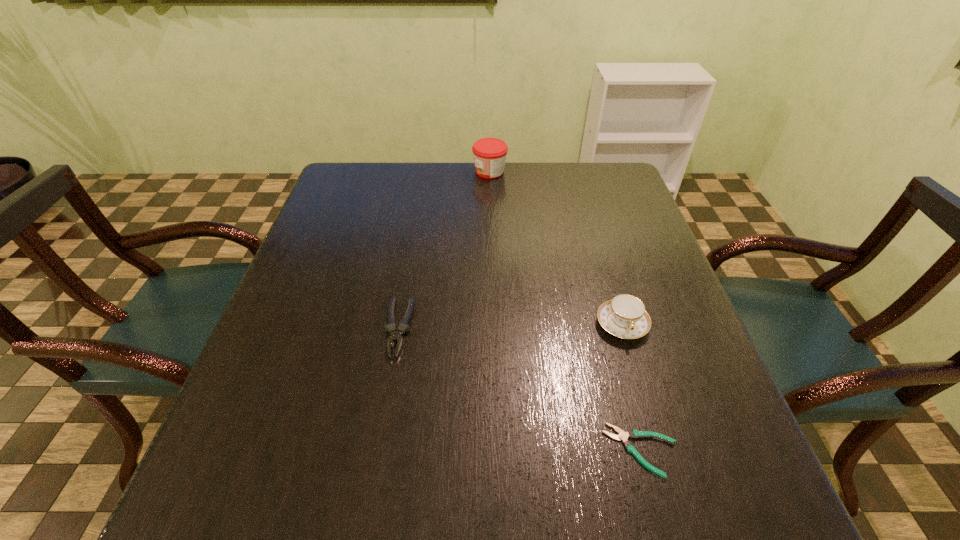
Locate an element on the screen. free spot between the teacup and the leftmost object is located at coordinates (511, 326).

This screenshot has width=960, height=540. I want to click on vacant space in between the tallest object and the leftmost object, so click(x=444, y=249).

The width and height of the screenshot is (960, 540). I want to click on free spot between the second tallest object and the taller pliers, so click(x=511, y=326).

At what (x,y) coordinates should I click in order to perform the action: click on unoccupied position between the nearer pliers and the third tallest object. Please return your answer as a coordinate pair (x, y). Looking at the image, I should click on (520, 389).

This screenshot has width=960, height=540. I want to click on object that is the second closest one to the right pliers, so click(395, 336).

In order to click on the second closest object to the third shortest object in this screenshot , I will do `click(395, 336)`.

Identify the location of vacant space that satisfies the following two spatial constraints: 1. on the label side of the tallest object; 2. on the left side of the nearest object. The image size is (960, 540). (498, 450).

This screenshot has height=540, width=960. I want to click on free spot that satisfies the following two spatial constraints: 1. on the label side of the shortest object; 2. on the left side of the third object from right to left, so click(498, 450).

At what (x,y) coordinates should I click in order to perform the action: click on vacant region that satisfies the following two spatial constraints: 1. on the label side of the second object from left to right; 2. on the right side of the nearer pliers. Please return your answer as a coordinate pair (x, y). This screenshot has width=960, height=540. Looking at the image, I should click on (498, 450).

What are the coordinates of `free point that satisfies the following two spatial constraints: 1. on the label side of the farthest object; 2. on the left side of the shorter pliers` in the screenshot? It's located at (498, 450).